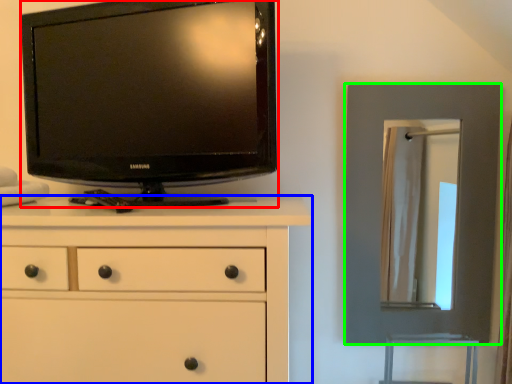
Question: Which is farther away from television (highlighted by a red box)? chest of drawers (highlighted by a blue box) or picture frame (highlighted by a green box)?

Choices:
 (A) chest of drawers
 (B) picture frame

Answer: (B)